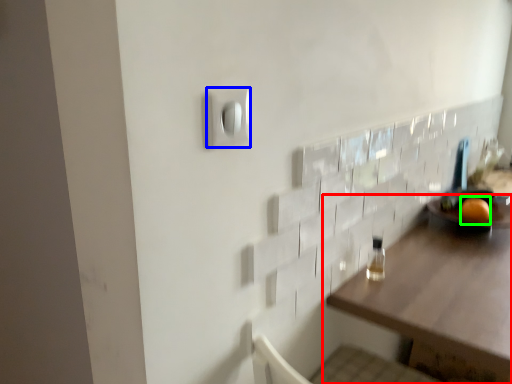
Question: Based on their relative distances, which object is nearer to table (highlighted by a red box)? Choose from light switch (highlighted by a blue box) and orange (highlighted by a green box).

Choices:
 (A) light switch
 (B) orange

Answer: (B)